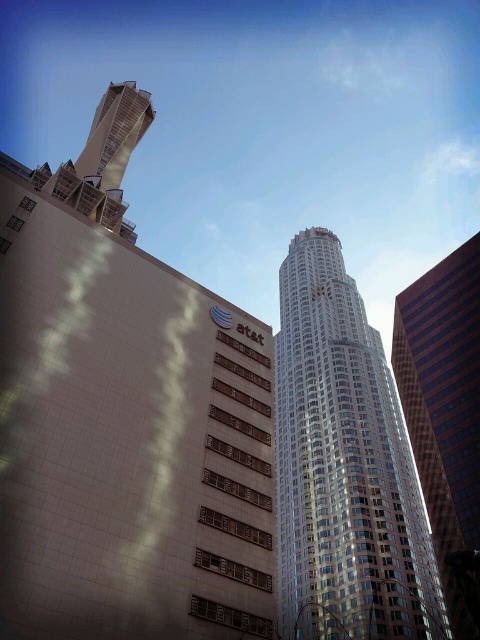
Who is more distant from viewer, (352, 296) or (469, 336)?

Positioned behind is point (352, 296).

In the scene shown: Which of these two, silver glass skyscraper at center or glassy reflective skyscraper at right, stands taller?

silver glass skyscraper at center is taller.

Describe the element at coordinates (344, 467) in the screenshot. The width and height of the screenshot is (480, 640). I see `silver glass skyscraper at center` at that location.

Locate an element on the screen. silver glass skyscraper at center is located at coordinates (344, 467).